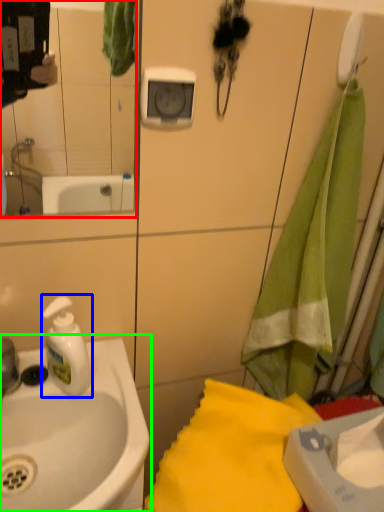
Question: Based on their relative distances, which object is farther from mirror (highlighted by a red box)? Choose from soap dispenser (highlighted by a blue box) and sink (highlighted by a green box).

Choices:
 (A) soap dispenser
 (B) sink

Answer: (A)